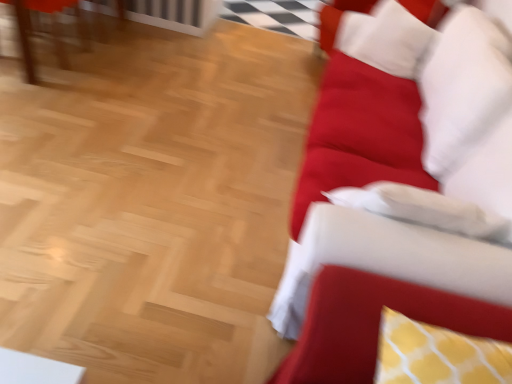
Question: From a real-world perspective, is matte wooden table at upper left physically located above or below yellow dotted cushion at right?

Choices:
 (A) above
 (B) below

Answer: (B)

Question: Considering the positions of matte wooden table at upper left and yellow dotted cushion at right in the image, is matte wooden table at upper left bigger or smaller than yellow dotted cushion at right?

Choices:
 (A) small
 (B) big

Answer: (B)

Question: Based on their relative distances, which object is nearer to the velvet red couch at right?

Choices:
 (A) yellow dotted cushion at right
 (B) white soft pillow at upper right
 (C) matte wooden table at upper left

Answer: (A)

Question: Which object is the closest to the yellow dotted cushion at right?

Choices:
 (A) velvet red couch at right
 (B) matte wooden table at upper left
 (C) white soft pillow at upper right

Answer: (A)